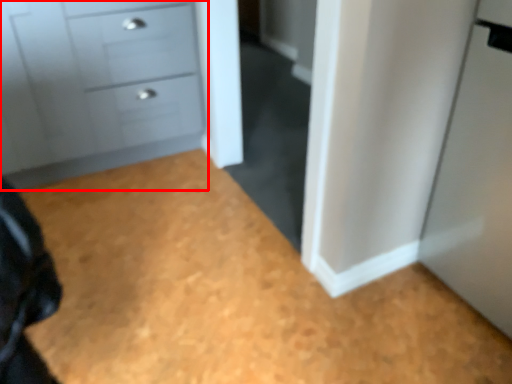
Question: From the image's perspective, what is the correct spatial relationship of chest of drawers (annotated by the red box) in relation to plain?

Choices:
 (A) below
 (B) above

Answer: (B)